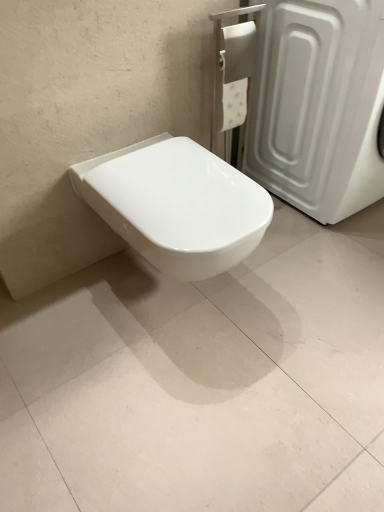
Question: Can white plastic screen door at upper right be found inside white glossy toilet at center?

Choices:
 (A) yes
 (B) no

Answer: (B)

Question: Is white glossy toilet at center completely or partially outside of white plastic screen door at upper right?

Choices:
 (A) no
 (B) yes

Answer: (B)

Question: Does white glossy toilet at center have a smaller size compared to white plastic screen door at upper right?

Choices:
 (A) no
 (B) yes

Answer: (B)

Question: Considering the relative sizes of white glossy toilet at center and white plastic screen door at upper right in the image provided, is white glossy toilet at center taller than white plastic screen door at upper right?

Choices:
 (A) yes
 (B) no

Answer: (B)

Question: Can you see white glossy toilet at center touching white plastic screen door at upper right?

Choices:
 (A) no
 (B) yes

Answer: (A)

Question: Is white glossy toilet at center turned away from white plastic screen door at upper right?

Choices:
 (A) yes
 (B) no

Answer: (B)

Question: Is white glossy toilet at center aimed at white glossy toilet at center?

Choices:
 (A) yes
 (B) no

Answer: (B)

Question: Does white glossy toilet at center lie behind white glossy toilet at center?

Choices:
 (A) no
 (B) yes

Answer: (A)

Question: Does white glossy toilet at center have a larger size compared to white glossy toilet at center?

Choices:
 (A) yes
 (B) no

Answer: (B)

Question: Is white glossy toilet at center oriented away from white glossy toilet at center?

Choices:
 (A) no
 (B) yes

Answer: (A)

Question: Considering the relative sizes of white glossy toilet at center and white glossy toilet at center in the image provided, is white glossy toilet at center shorter than white glossy toilet at center?

Choices:
 (A) yes
 (B) no

Answer: (A)

Question: Is white glossy toilet at center located outside white glossy toilet at center?

Choices:
 (A) no
 (B) yes

Answer: (B)

Question: Does white glossy toilet at center lie behind white glossy toilet at center?

Choices:
 (A) yes
 (B) no

Answer: (A)